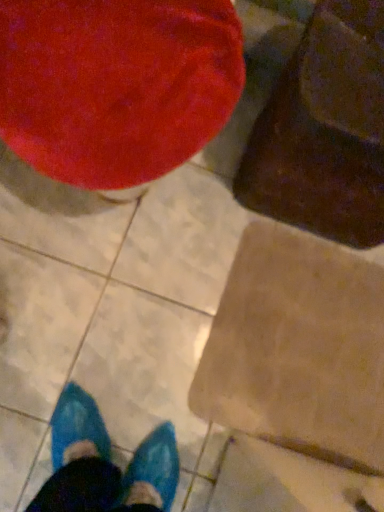
Find the location of `free space in front of velvety brown bean bag chair at upper right, the second bean bag chair viewed from the left`. free space in front of velvety brown bean bag chair at upper right, the second bean bag chair viewed from the left is located at coordinates (260, 301).